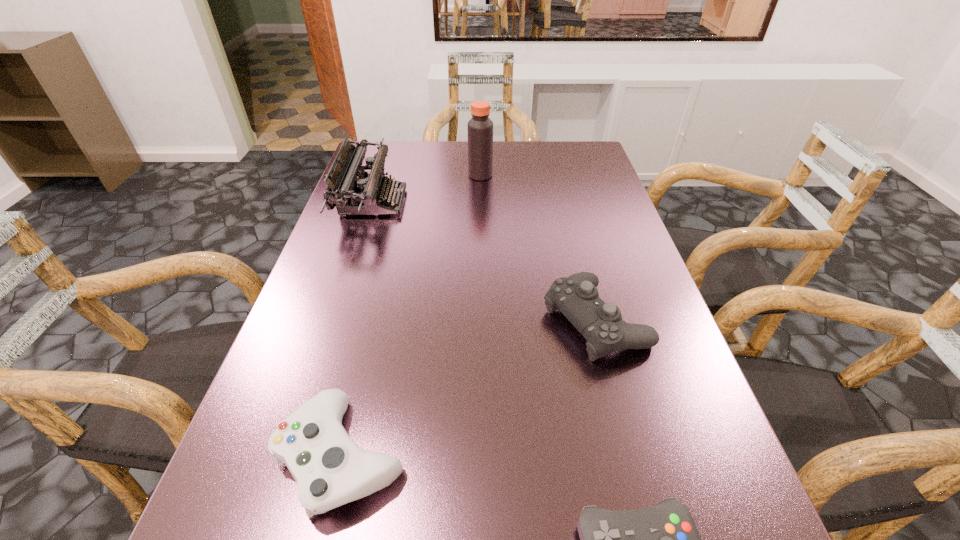
Identify the location of blank space that satisfies the following two spatial constraints: 1. on the front side of the tallest object; 2. on the typing side of the fourth shortest object. (480, 202).

You are a GUI agent. You are given a task and a screenshot of the screen. Output one action in this format:
    pyautogui.click(x=<x>, y=<y>)
    Task: Click on the free spot that satisfies the following two spatial constraints: 1. on the typing side of the leftmost control; 2. on the right side of the second tallest object
    Image resolution: width=960 pixels, height=540 pixels.
    Given the screenshot: What is the action you would take?
    pyautogui.click(x=290, y=455)

At what (x,y) coordinates should I click in order to perform the action: click on free location that satisfies the following two spatial constraints: 1. on the typing side of the typewriter; 2. on the right side of the third nearest object. Please return your answer as a coordinate pair (x, y). Image resolution: width=960 pixels, height=540 pixels. Looking at the image, I should click on 334,321.